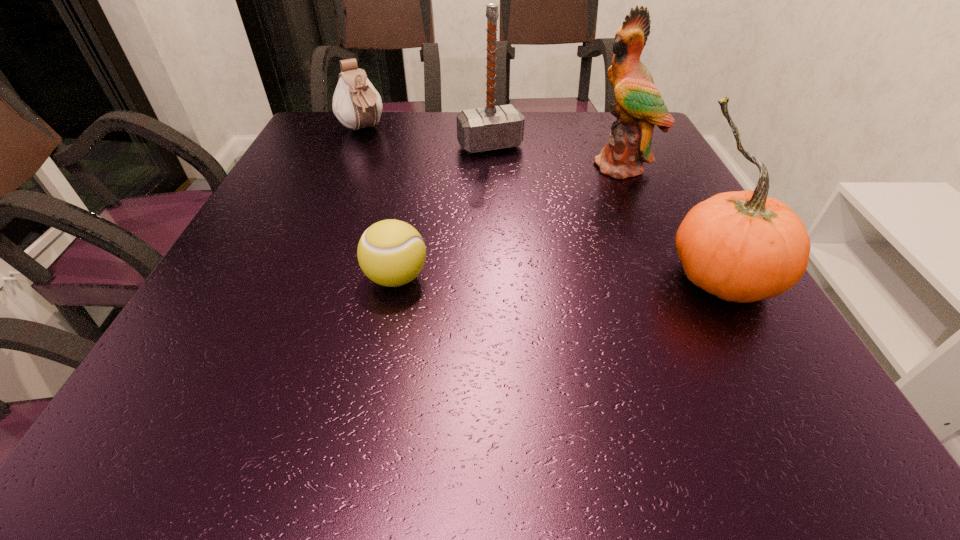
Locate an element on the screen. The image size is (960, 540). vacant space in between the leftmost object and the tennis ball is located at coordinates (379, 204).

This screenshot has height=540, width=960. Find the location of `free spot between the pumpkin and the tennis ball`. free spot between the pumpkin and the tennis ball is located at coordinates pos(559,278).

You are a GUI agent. You are given a task and a screenshot of the screen. Output one action in this format:
    pyautogui.click(x=<x>, y=<y>)
    Task: Click on the object that is the second closest to the parrot
    
    Given the screenshot: What is the action you would take?
    pyautogui.click(x=741, y=246)

Where is `the second closest object relative to the third object from left to right`? The width and height of the screenshot is (960, 540). the second closest object relative to the third object from left to right is located at coordinates (356, 103).

What are the coordinates of `vacant position in the image that satisfies the following two spatial constraints: 1. on the front side of the leftmost object; 2. on the right side of the pumpkin` in the screenshot? It's located at (299, 278).

The image size is (960, 540). I want to click on free location that satisfies the following two spatial constraints: 1. on the back side of the parrot; 2. on the left side of the fourth object from right to left, so click(x=419, y=165).